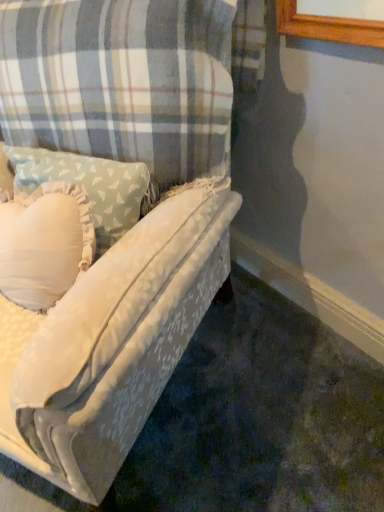
What do you see at coordinates (89, 186) in the screenshot? I see `white soft pillow at center` at bounding box center [89, 186].

Locate an element on the screen. Image resolution: width=384 pixels, height=512 pixels. white soft pillow at center is located at coordinates (89, 186).

Describe the element at coordinates (130, 230) in the screenshot. I see `velvet-like fabric couch at center` at that location.

The width and height of the screenshot is (384, 512). Find the location of `velvet-like fabric couch at center`. velvet-like fabric couch at center is located at coordinates (130, 230).

Where is `white soft pillow at center`? The height and width of the screenshot is (512, 384). white soft pillow at center is located at coordinates tap(89, 186).

Which is more to the right, velvet-like fabric couch at center or white soft pillow at center?

white soft pillow at center.

Is velvet-like fabric couch at center behind white soft pillow at center?

No, it is in front of white soft pillow at center.

Considering the positions of points (65, 393) and (59, 160), is point (65, 393) closer to camera compared to point (59, 160)?

Yes, point (65, 393) is in front of point (59, 160).

In the scene shown: From the image's perspective, is velvet-like fabric couch at center located above white soft pillow at center?

No, from the image's perspective, velvet-like fabric couch at center is not on top of white soft pillow at center.

Looking at this image, from a real-world perspective, is velvet-like fabric couch at center located beneath white soft pillow at center?

Yes, from a real-world perspective, velvet-like fabric couch at center is below white soft pillow at center.

Considering the relative sizes of velvet-like fabric couch at center and white soft pillow at center in the image provided, is velvet-like fabric couch at center thinner than white soft pillow at center?

No, velvet-like fabric couch at center is not thinner than white soft pillow at center.

In terms of height, does velvet-like fabric couch at center look taller or shorter compared to white soft pillow at center?

In the image, velvet-like fabric couch at center appears to be taller than white soft pillow at center.

Is velvet-like fabric couch at center bigger than white soft pillow at center?

Correct, velvet-like fabric couch at center is larger in size than white soft pillow at center.

Is velvet-like fabric couch at center located outside white soft pillow at center?

velvet-like fabric couch at center lies outside white soft pillow at center's area.

Is velvet-like fabric couch at center touching white soft pillow at center?

There is a gap between velvet-like fabric couch at center and white soft pillow at center.

Is velvet-like fabric couch at center facing away from white soft pillow at center?

Yes, velvet-like fabric couch at center's orientation is away from white soft pillow at center.

This screenshot has width=384, height=512. What are the coordinates of `studio couch in front of the white soft pillow at center` in the screenshot? It's located at (130, 230).

Considering the relative positions of white soft pillow at center and velvet-like fabric couch at center in the image provided, is white soft pillow at center to the left or to the right of velvet-like fabric couch at center?

Based on their positions, white soft pillow at center is located to the right of velvet-like fabric couch at center.

Which is in front, white soft pillow at center or velvet-like fabric couch at center?

velvet-like fabric couch at center.

Which is behind, point (103, 221) or point (126, 243)?

The point (103, 221) is farther from the camera.

From the image's perspective, is white soft pillow at center above or below velvet-like fabric couch at center?

Clearly, from the image's perspective, white soft pillow at center is above velvet-like fabric couch at center.

From a real-world perspective, between white soft pillow at center and velvet-like fabric couch at center, who is vertically higher?

From a 3D spatial view, white soft pillow at center is above.

Does white soft pillow at center have a lesser width compared to velvet-like fabric couch at center?

Yes.

Can you confirm if white soft pillow at center is shorter than velvet-like fabric couch at center?

Correct, white soft pillow at center is not as tall as velvet-like fabric couch at center.

Considering the relative sizes of white soft pillow at center and velvet-like fabric couch at center in the image provided, is white soft pillow at center smaller than velvet-like fabric couch at center?

Yes, white soft pillow at center is smaller than velvet-like fabric couch at center.

Based on the photo, is white soft pillow at center situated inside velvet-like fabric couch at center or outside?

white soft pillow at center is located inside velvet-like fabric couch at center.

Are white soft pillow at center and velvet-like fabric couch at center making contact?

white soft pillow at center and velvet-like fabric couch at center are clearly separated.

Could you tell me if white soft pillow at center is facing velvet-like fabric couch at center?

Yes, white soft pillow at center is turned towards velvet-like fabric couch at center.

What's the angular difference between white soft pillow at center and velvet-like fabric couch at center's facing directions?

The facing directions of white soft pillow at center and velvet-like fabric couch at center are 5.66e-05 degrees apart.

Measure the distance from white soft pillow at center to velvet-like fabric couch at center.

The distance of white soft pillow at center from velvet-like fabric couch at center is 7.08 inches.

The image size is (384, 512). I want to click on studio couch below the white soft pillow at center (from a real-world perspective), so click(x=130, y=230).

What are the coordinates of `studio couch below the white soft pillow at center (from the image's perspective)` in the screenshot? It's located at (130, 230).

Locate an element on the screen. This screenshot has width=384, height=512. pillow above the velvet-like fabric couch at center (from a real-world perspective) is located at coordinates (89, 186).